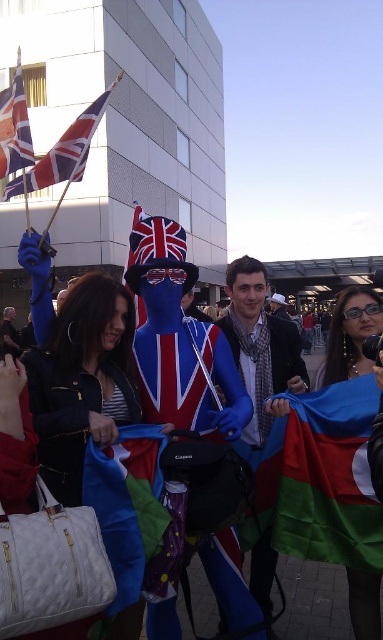
Who is more forward, (x=55, y=154) or (x=6, y=157)?

Point (x=6, y=157) is in front.

The image size is (383, 640). In order to click on union jack flag at upper left in this screenshot , I will do `click(65, 150)`.

Describe the element at coordinates (65, 150) in the screenshot. I see `union jack flag at upper left` at that location.

This screenshot has width=383, height=640. I want to click on union jack flag at upper left, so click(x=65, y=150).

This screenshot has width=383, height=640. What are the coordinates of `polyester flag at center` in the screenshot? It's located at (330, 477).

Does polyester flag at center have a larger size compared to union jack fabric flag at upper left?

No.

Where is `polyester flag at center`? The width and height of the screenshot is (383, 640). polyester flag at center is located at coordinates (330, 477).

Identify the location of polyester flag at center. Image resolution: width=383 pixels, height=640 pixels. (330, 477).

Is blue fabric jacket at center to the right of union jack flag at upper left from the viewer's perspective?

Yes, blue fabric jacket at center is to the right of union jack flag at upper left.

Measure the distance from blue fabric jacket at center to union jack flag at upper left.

blue fabric jacket at center is 8.51 meters away from union jack flag at upper left.

You are a GUI agent. You are given a task and a screenshot of the screen. Output one action in this format:
    pyautogui.click(x=<x>, y=<y>)
    Task: Click on the blue fabric jacket at center
    The height and width of the screenshot is (640, 383).
    Given the screenshot: What is the action you would take?
    pyautogui.click(x=260, y=346)